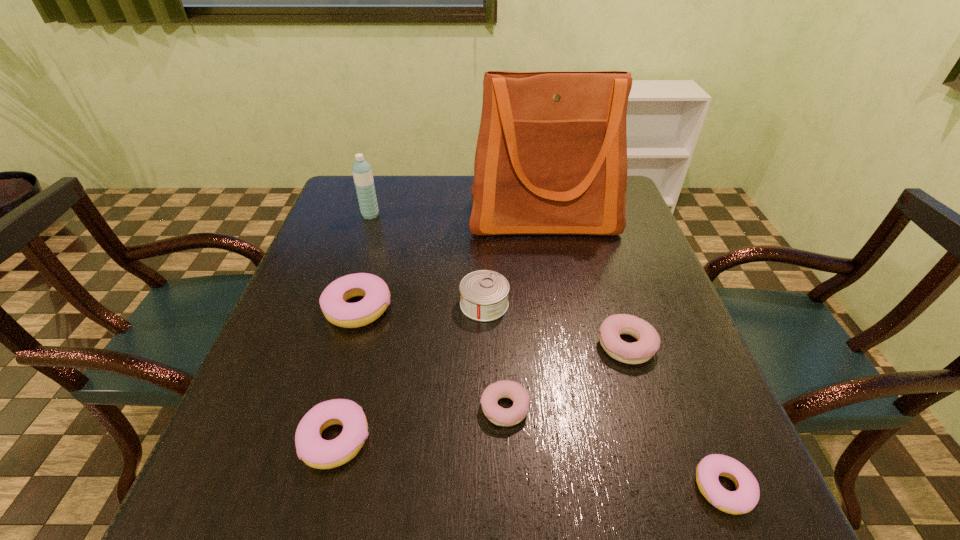
I want to click on free location that satisfies the following two spatial constraints: 1. on the front side of the blue water bottle; 2. on the left side of the third doughnut from left to right, so click(307, 408).

At what (x,y) coordinates should I click in order to perform the action: click on free space that satisfies the following two spatial constraints: 1. on the front pocket of the rightmost pink doughnut; 2. on the right side of the shopping bag. Please return your answer as a coordinate pair (x, y). Image resolution: width=960 pixels, height=540 pixels. Looking at the image, I should click on (593, 488).